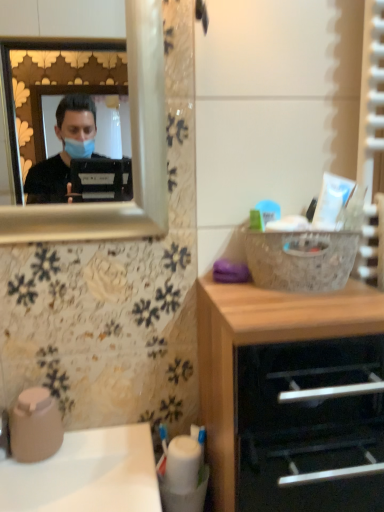
You are a GUI agent. You are given a task and a screenshot of the screen. Output one action in this format:
    pyautogui.click(x=<x>, y=<y>)
    Task: Click on the vacant space situated above white glossy sink at lower left (from a real-world perspective)
    The width and height of the screenshot is (384, 512).
    Given the screenshot: What is the action you would take?
    pyautogui.click(x=81, y=450)